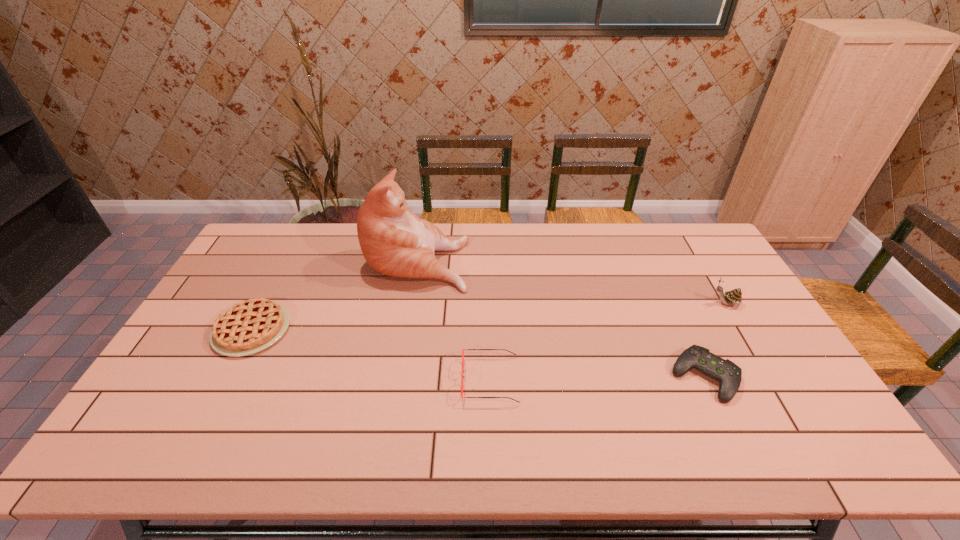
What are the coordinates of `free region at the far edge of the desktop` in the screenshot? It's located at (636, 253).

What are the coordinates of `vacant region at the near edge` in the screenshot? It's located at (302, 430).

In the image, there is a desktop. At what (x,y) coordinates should I click in order to perform the action: click on free space at the left edge. Please return your answer as a coordinate pair (x, y). The image size is (960, 540). Looking at the image, I should click on (160, 408).

This screenshot has width=960, height=540. In the image, there is a desktop. Identify the location of vacant region at the right edge. (733, 318).

Where is `vacant space in between the spectacles and the cat`? vacant space in between the spectacles and the cat is located at coordinates (454, 320).

Find the location of a particular element. vacant point located between the leftmost object and the snail is located at coordinates (489, 316).

At what (x,y) coordinates should I click in order to perform the action: click on vacant space that's between the fourth object from left to right and the farthest object. Please return your answer as a coordinate pair (x, y). This screenshot has height=540, width=960. Looking at the image, I should click on point(562,318).

The image size is (960, 540). What are the coordinates of `unoccupied position between the second tallest object and the tallest object` in the screenshot? It's located at (571, 281).

The height and width of the screenshot is (540, 960). Identify the location of blank region between the second object from right to left and the pie. (478, 353).

Identify the location of free space between the control and the second tallest object. (715, 340).